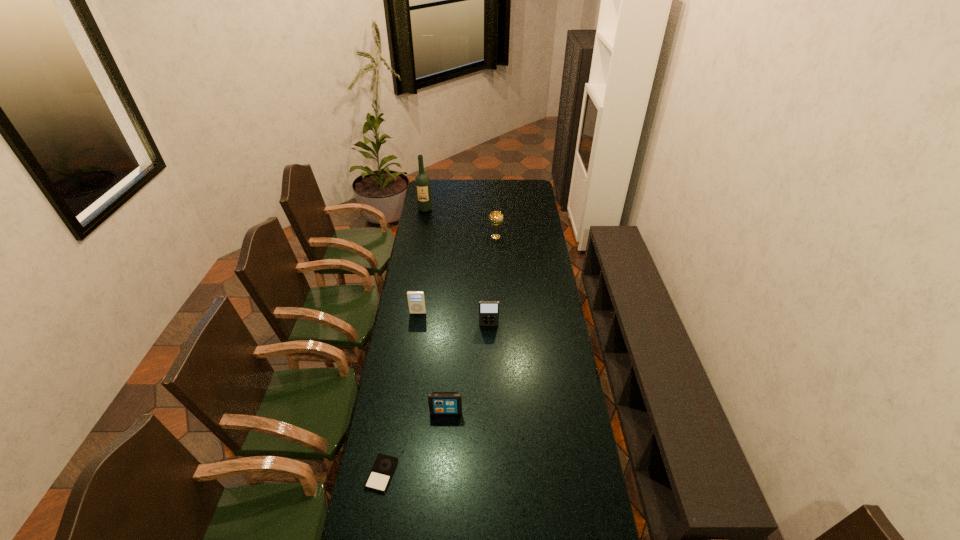
Locate which object ranks fourth in proximity to the fourth nearest object. Please provide its 2D coordinates. Your answer should be formatted as a tuple, i.e. [(x, y)], where the tuple contains the x and y coordinates of a point satisfying the conditions above.

[(384, 466)]

Identify the location of iPod that is the second closest to the second nearest iPod. (488, 310).

Find the location of a particular element. The height and width of the screenshot is (540, 960). the second closest iPod relative to the farthest iPod is located at coordinates (440, 403).

Find the location of a particular element. This screenshot has height=540, width=960. vacant point that satisfies the following two spatial constraints: 1. on the labeled side of the chalice; 2. on the left side of the wine bottle is located at coordinates (420, 237).

Locate an element on the screen. The height and width of the screenshot is (540, 960). free space that satisfies the following two spatial constraints: 1. on the back side of the nearest iPod; 2. on the left side of the chalice is located at coordinates (422, 237).